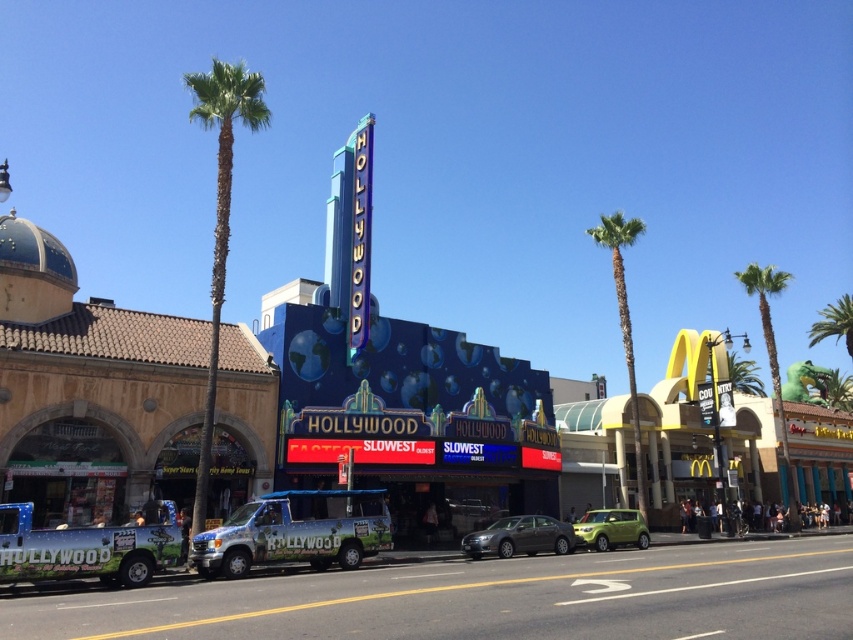
Consider the image. You are standing at the center of the street looking towards the Hollywood sign. Which direction should you turn to see the green leafy palm tree at left?

The green leafy palm tree at left is located at point [219,212] in the image, which corresponds to the left side of the scene. Since you are facing the Hollywood sign, turning to your left would allow you to see the green leafy palm tree at left.